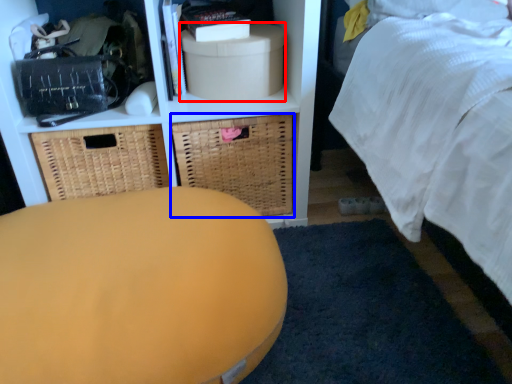
Question: Which point is closer to the camera, storage box (highlighted by a red box) or basket (highlighted by a blue box)?

Choices:
 (A) storage box
 (B) basket

Answer: (A)